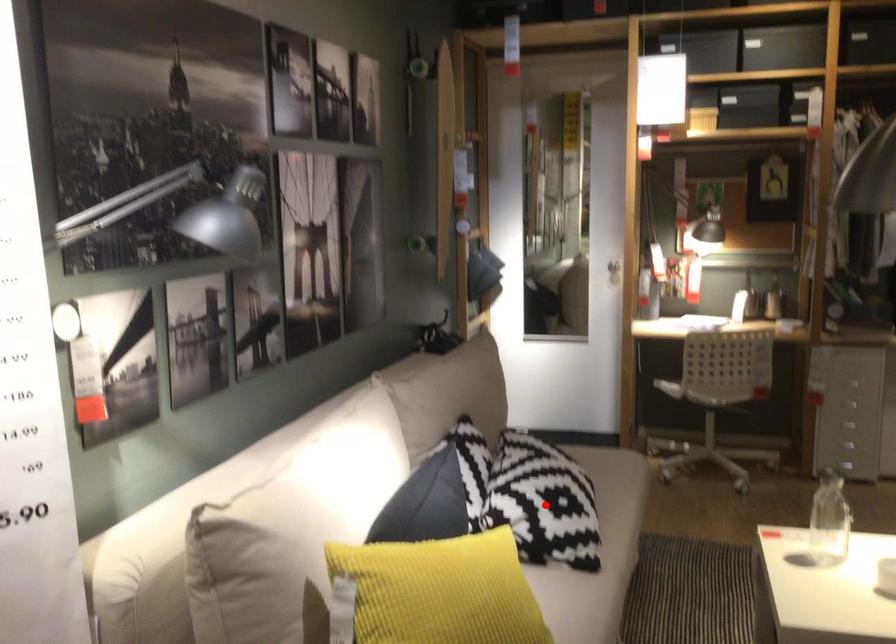
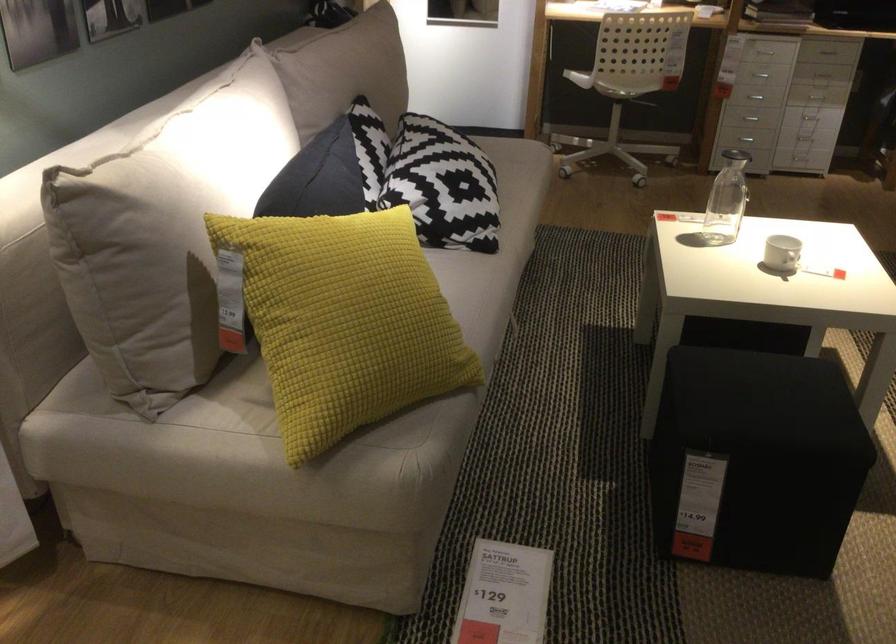
Locate, in the second image, the point that corresponds to the highlighted location in the first image.

(442, 185)